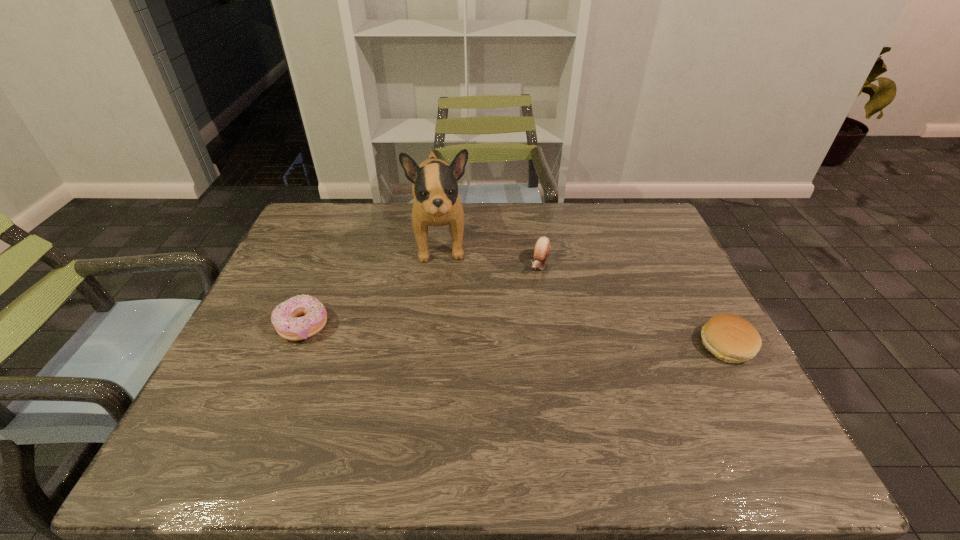
At what (x,y) coordinates should I click in order to perform the action: click on empty space that is in between the puppy and the patty. Please return your answer as a coordinate pair (x, y). Looking at the image, I should click on (584, 292).

Select which object appears as the third closest to the rightmost object. Please provide its 2D coordinates. Your answer should be formatted as a tuple, i.e. [(x, y)], where the tuple contains the x and y coordinates of a point satisfying the conditions above.

[(286, 319)]

Locate which object is the third closest to the rightmost object. Please provide its 2D coordinates. Your answer should be formatted as a tuple, i.e. [(x, y)], where the tuple contains the x and y coordinates of a point satisfying the conditions above.

[(286, 319)]

Image resolution: width=960 pixels, height=540 pixels. Identify the location of blank area in the image that satisfies the following two spatial constraints: 1. on the back side of the doughnut; 2. on the right side of the escargot. (328, 265).